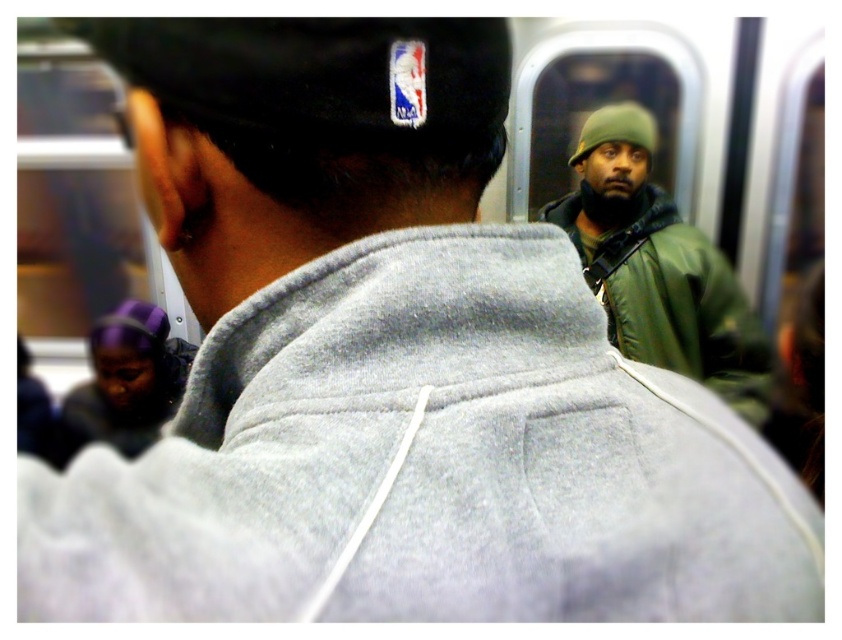
You are a photographer trying to capture the best angle of the two green items in the subway car. Since you want both the green matte jacket at center and the green matte baseball hat at upper center in the frame, which one should you position closer to the left side of your camera viewfinder to ensure both are visible?

To ensure both the green matte jacket at center and the green matte baseball hat at upper center are visible in the frame, position the green matte baseball hat at upper center closer to the left side of your camera viewfinder. This is because the green matte jacket at center is to the right of the green matte baseball hat at upper center, so placing the hat on the left allows the jacket to naturally fall to the right within the viewfinder.